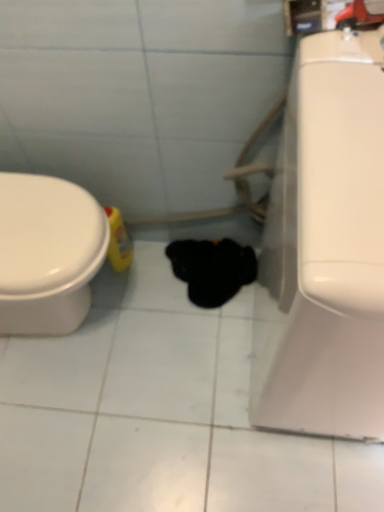
Question: Considering the positions of black fuzzy cat at center and white glossy toilet at right in the image, is black fuzzy cat at center wider or thinner than white glossy toilet at right?

Choices:
 (A) thin
 (B) wide

Answer: (A)

Question: From the image's perspective, is black fuzzy cat at center located above or below white glossy toilet at right?

Choices:
 (A) below
 (B) above

Answer: (A)

Question: In the image, is black fuzzy cat at center positioned in front of or behind white glossy toilet at right?

Choices:
 (A) behind
 (B) front

Answer: (A)

Question: In terms of width, does white glossy toilet at right look wider or thinner when compared to black fuzzy cat at center?

Choices:
 (A) thin
 (B) wide

Answer: (B)

Question: Is white glossy toilet at right to the left or to the right of black fuzzy cat at center in the image?

Choices:
 (A) right
 (B) left

Answer: (A)

Question: Does point [336, 162] appear closer or farther from the camera than point [175, 272]?

Choices:
 (A) closer
 (B) farther

Answer: (A)

Question: From the image's perspective, is white glossy toilet at right positioned above or below black fuzzy cat at center?

Choices:
 (A) below
 (B) above

Answer: (B)